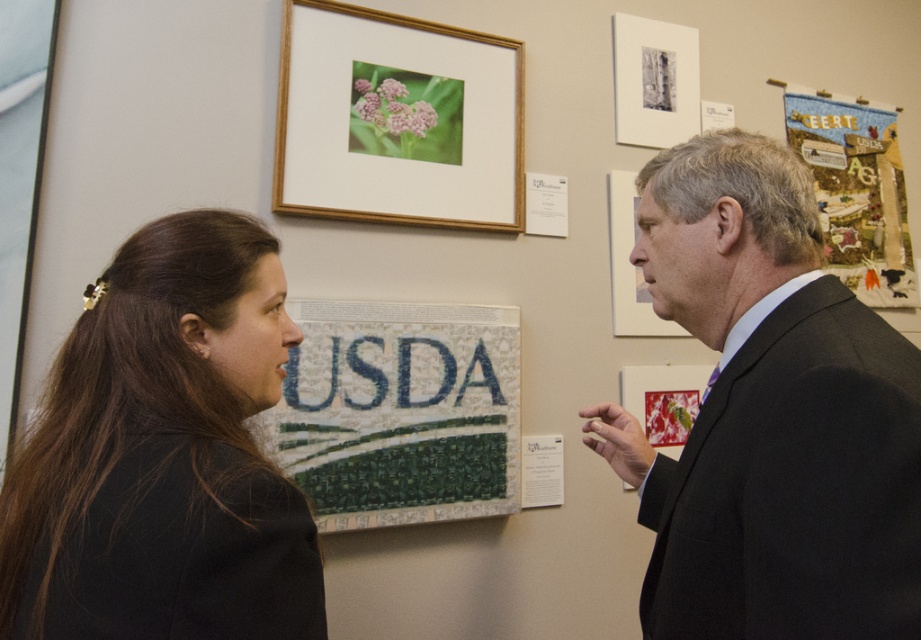
Is textured fabric poster at upper right smaller than matte wood picture frame at upper right?

Incorrect, textured fabric poster at upper right is not smaller in size than matte wood picture frame at upper right.

This screenshot has height=640, width=921. Describe the element at coordinates (857, 193) in the screenshot. I see `textured fabric poster at upper right` at that location.

Between point (824, 132) and point (628, 291), which one is positioned behind?

The point (824, 132) is behind.

The image size is (921, 640). I want to click on textured fabric poster at upper right, so click(857, 193).

Locate an element on the screen. The image size is (921, 640). mosaic tile usda sign at center is located at coordinates (399, 412).

Between mosaic tile usda sign at center and matte wood picture frame at upper right, which one is positioned higher?

matte wood picture frame at upper right

Is point (478, 360) less distant than point (639, 289)?

Yes, point (478, 360) is closer to viewer.

Where is `mosaic tile usda sign at center`? The image size is (921, 640). mosaic tile usda sign at center is located at coordinates (399, 412).

Between point (686, 225) and point (188, 472), which one is positioned in front?

Positioned in front is point (188, 472).

Where is `dark suit at right`? This screenshot has width=921, height=640. dark suit at right is located at coordinates (768, 416).